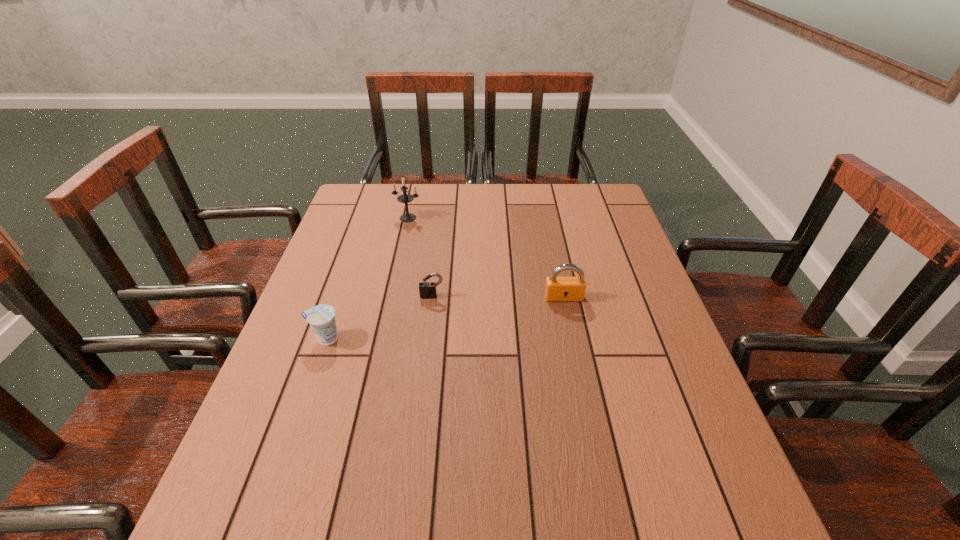
This screenshot has height=540, width=960. I want to click on vacant region located on the front of the nearest object, so click(x=259, y=532).

Find the location of `free location located 0.260m with the keyhole on the front of the second object from right to left`. free location located 0.260m with the keyhole on the front of the second object from right to left is located at coordinates [x=422, y=382].

Image resolution: width=960 pixels, height=540 pixels. In order to click on object located in the far edge section of the desktop in this screenshot , I will do `click(405, 198)`.

This screenshot has height=540, width=960. Find the location of `object that is positioned at the left edge`. object that is positioned at the left edge is located at coordinates (321, 318).

The height and width of the screenshot is (540, 960). In the image, there is a desktop. Find the location of `free space at the far edge`. free space at the far edge is located at coordinates (456, 217).

This screenshot has width=960, height=540. Find the location of `vacant area at the near edge of the desktop`. vacant area at the near edge of the desktop is located at coordinates pos(352,513).

I want to click on free space at the left edge of the desktop, so click(331, 373).

This screenshot has height=540, width=960. In the image, there is a desktop. Identify the location of vacant area at the right edge. (586, 230).

The height and width of the screenshot is (540, 960). In the image, there is a desktop. Identify the location of vacant space at the far left corner. (370, 188).

Where is `free point between the taller padlock and the yogurt`? free point between the taller padlock and the yogurt is located at coordinates (444, 318).